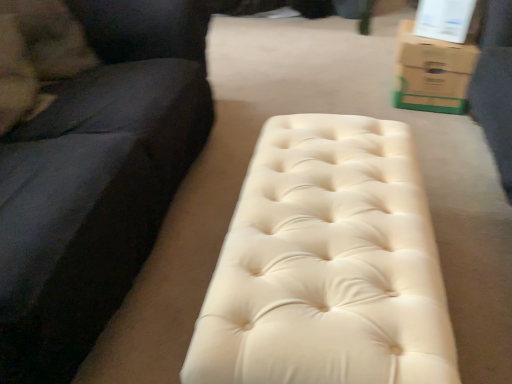
Question: Does brown cardboard box at upper right have a greater width compared to creamy leather bench at center?

Choices:
 (A) yes
 (B) no

Answer: (B)

Question: Is brown cardboard box at upper right turned away from creamy leather bench at center?

Choices:
 (A) yes
 (B) no

Answer: (B)

Question: Can you confirm if brown cardboard box at upper right is positioned to the right of creamy leather bench at center?

Choices:
 (A) no
 (B) yes

Answer: (B)

Question: Is creamy leather bench at center a part of brown cardboard box at upper right?

Choices:
 (A) yes
 (B) no

Answer: (B)

Question: Considering the relative sizes of brown cardboard box at upper right and creamy leather bench at center in the image provided, is brown cardboard box at upper right taller than creamy leather bench at center?

Choices:
 (A) no
 (B) yes

Answer: (A)

Question: Is creamy leather bench at center in front of or behind brown cardboard box at upper right in the image?

Choices:
 (A) front
 (B) behind

Answer: (A)

Question: From the image's perspective, relative to brown cardboard box at upper right, is creamy leather bench at center above or below?

Choices:
 (A) below
 (B) above

Answer: (A)

Question: From a real-world perspective, relative to brown cardboard box at upper right, is creamy leather bench at center vertically above or below?

Choices:
 (A) below
 (B) above

Answer: (B)

Question: Considering the positions of point (368, 165) and point (441, 49), is point (368, 165) closer or farther from the camera than point (441, 49)?

Choices:
 (A) closer
 (B) farther

Answer: (A)

Question: Looking at the image, does brown cardboard box at upper right seem bigger or smaller compared to suede black studio couch at left?

Choices:
 (A) small
 (B) big

Answer: (A)

Question: Is point (443, 81) closer or farther from the camera than point (40, 306)?

Choices:
 (A) farther
 (B) closer

Answer: (A)

Question: In terms of width, does brown cardboard box at upper right look wider or thinner when compared to suede black studio couch at left?

Choices:
 (A) thin
 (B) wide

Answer: (A)

Question: Is brown cardboard box at upper right to the left or to the right of suede black studio couch at left in the image?

Choices:
 (A) left
 (B) right

Answer: (B)

Question: From a real-world perspective, relative to suede black studio couch at left, is creamy leather bench at center vertically above or below?

Choices:
 (A) below
 (B) above

Answer: (A)

Question: In the image, is creamy leather bench at center positioned in front of or behind suede black studio couch at left?

Choices:
 (A) behind
 (B) front

Answer: (A)